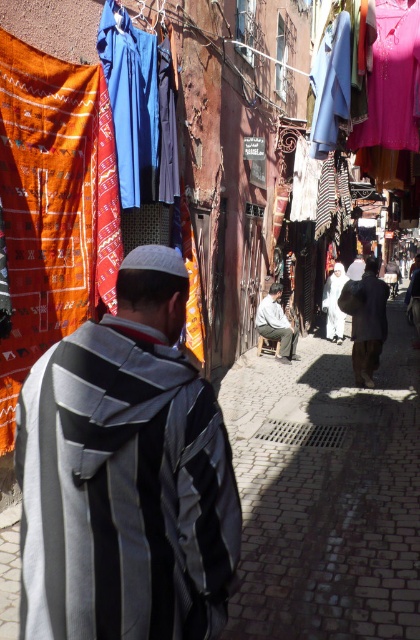
You are a traveler in this market and want to buy the striped woolen shawl at center. Where exactly should you look to find it?

The striped woolen shawl at center is located at point 0.744 on the x axis and 0.300 on the y axis.

You are a traveler standing in the market and want to buy both the dark gray fabric bag at center and the light brown leather jacket at center. If you pick up the one that is closer to you first, which one would you pick?

The dark gray fabric bag at center is in front of the light brown leather jacket at center, so you would pick up the dark gray fabric bag at center first since it is closer to you.

Looking at this image, you are a traveler carrying a backpack and see the dark gray fabric bag at center and the light brown leather jacket at center displayed in a market. Which item can you more easily slide into your backpack without removing other items?

The dark gray fabric bag at center is thinner than the light brown leather jacket at center, so it can be more easily slid into your backpack without removing other items.